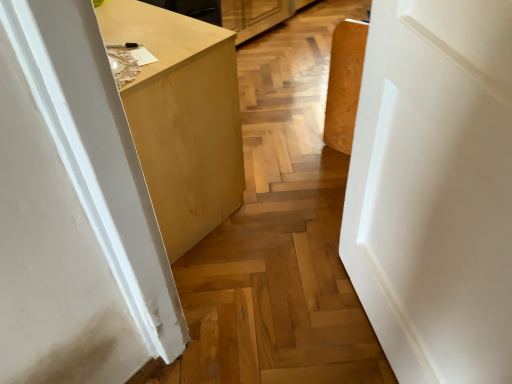
You are a GUI agent. You are given a task and a screenshot of the screen. Output one action in this format:
    pyautogui.click(x=<x>, y=<y>)
    Task: Click on the vacant region to the left of white matte door at center
    Image resolution: width=512 pixels, height=384 pixels.
    Given the screenshot: What is the action you would take?
    point(272,314)